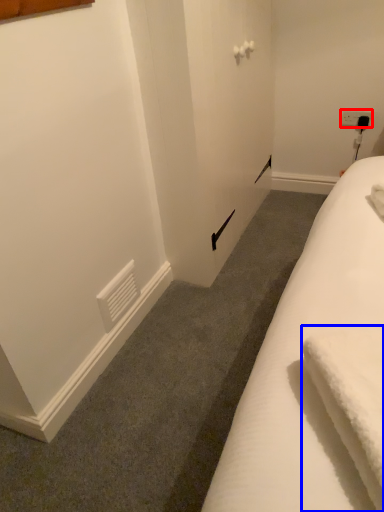
Question: Among these objects, which one is farthest to the camera, electric outlet (highlighted by a red box) or bath towel (highlighted by a blue box)?

Choices:
 (A) electric outlet
 (B) bath towel

Answer: (A)